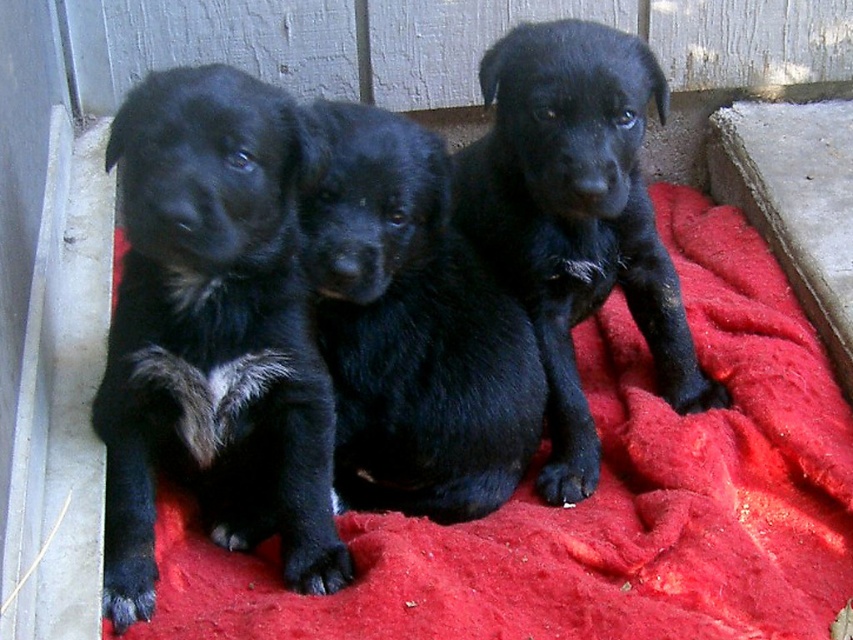
Does red fleece dog bed at center appear over black fur puppy at left?

No.

Is point (822, 513) more distant than point (144, 369)?

Yes, it is behind point (144, 369).

What do you see at coordinates (601, 499) in the screenshot? I see `red fleece dog bed at center` at bounding box center [601, 499].

This screenshot has height=640, width=853. What are the coordinates of `red fleece dog bed at center` in the screenshot? It's located at (601, 499).

Between black fur puppy at left and matte black puppy at center, which one appears on the right side from the viewer's perspective?

matte black puppy at center

Measure the distance between black fur puppy at left and matte black puppy at center.

The distance of black fur puppy at left from matte black puppy at center is 18.07 inches.

Between point (253, 211) and point (555, 314), which one is positioned behind?

The point (555, 314) is more distant.

Locate an element on the screen. The width and height of the screenshot is (853, 640). black fur puppy at left is located at coordinates (215, 332).

Identify the location of red fleece dog bed at center. (601, 499).

Which is more to the left, red fleece dog bed at center or black furry dog at center?

black furry dog at center

At what (x,y) coordinates should I click in order to perform the action: click on red fleece dog bed at center. Please return your answer as a coordinate pair (x, y). Looking at the image, I should click on (601, 499).

Image resolution: width=853 pixels, height=640 pixels. Find the location of `red fleece dog bed at center`. red fleece dog bed at center is located at coordinates (601, 499).